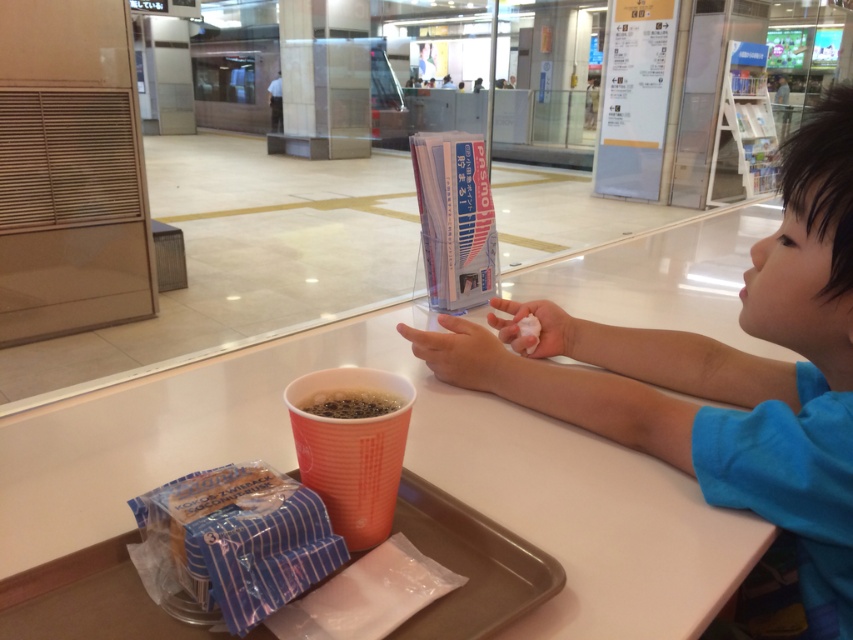
Does point (827, 365) come in front of point (152, 634)?

No, (827, 365) is further to viewer.

The height and width of the screenshot is (640, 853). In order to click on blue cotton shirt at right in this screenshot , I will do `click(753, 392)`.

In the scene shown: Between smooth skin hand at center and white matte tissue at center, which one is positioned higher?

white matte tissue at center is higher up.

Who is more distant from viewer, (490,371) or (544,330)?

Positioned behind is point (544,330).

Find the location of a particular element. This screenshot has width=853, height=640. smooth skin hand at center is located at coordinates (467, 356).

Where is `orange paper cup at lower center`? This screenshot has width=853, height=640. orange paper cup at lower center is located at coordinates (351, 451).

Is orange paper cup at lower center taller than smooth skin hand at center?

Correct, orange paper cup at lower center is much taller as smooth skin hand at center.

Who is more forward, (287, 406) or (483, 333)?

Point (287, 406)

Where is `orange paper cup at lower center`? The height and width of the screenshot is (640, 853). orange paper cup at lower center is located at coordinates (351, 451).